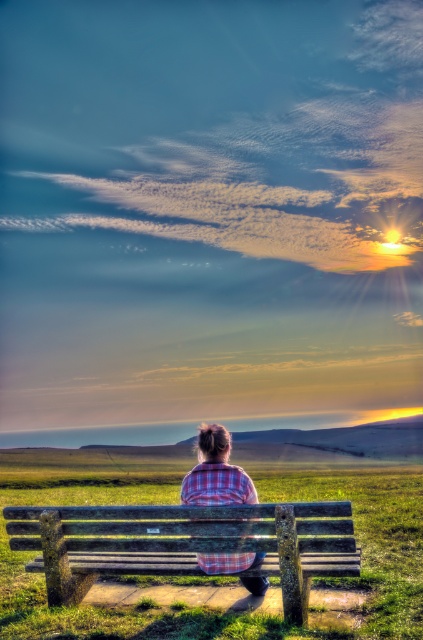
You are standing at the point labeled point (98, 529) and want to walk to the point labeled point (264, 588). Based on the scene description, will the path between these two points be obstructed by the wooden bench?

The point labeled point (98, 529) is in front of point labeled point (264, 588). Since the wooden bench is where the person is sitting, the path between these two points may be obstructed by the bench depending on their positions relative to it. However, the scene description does not provide specific details about the bench location or the exact path between the points. Therefore, it is unclear if the path is obstructed.

In the scene shown: You are standing behind the wooden bench at center and want to see the person wearing the plaid fabric shirt at center. Can you see the person through the bench?

The wooden bench at center is in front of the plaid fabric shirt at center, so you cannot see the person through the bench.